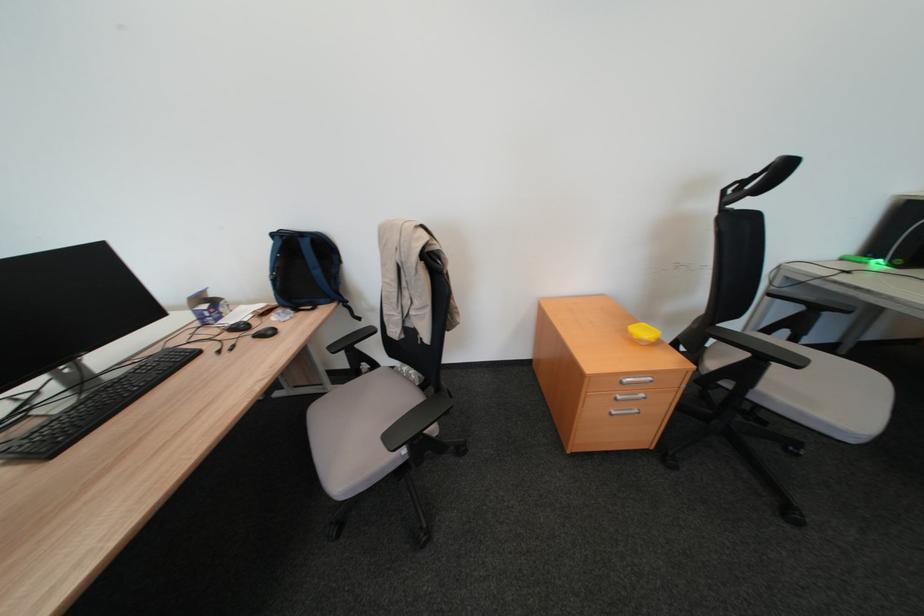
This screenshot has width=924, height=616. What do you see at coordinates (95, 407) in the screenshot?
I see `a black keyboard` at bounding box center [95, 407].